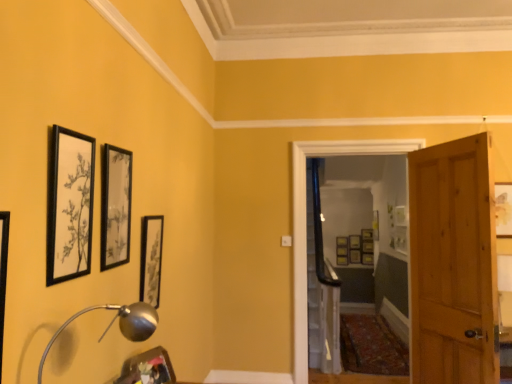
How much space does wooden door at center, which appears as the first door when viewed from the back, occupy vertically?

6.70 feet.

The height and width of the screenshot is (384, 512). What are the coordinates of `wooden door at center, which appears as the first door when viewed from the back` in the screenshot? It's located at (445, 224).

You are a GUI agent. You are given a task and a screenshot of the screen. Output one action in this format:
    pyautogui.click(x=<x>, y=<y>)
    Task: Click on the wooden picture frame at center, the 9th picture frame in the right-to-left sequence
    This screenshot has height=384, width=512.
    Given the screenshot: What is the action you would take?
    pyautogui.click(x=342, y=260)

The height and width of the screenshot is (384, 512). I want to click on wooden picture frame at center, the 10th picture frame in the front-to-back sequence, so click(355, 256).

What is the approximate height of matte black picture frame at center, which is the 3th picture frame in right-to-left order?

matte black picture frame at center, which is the 3th picture frame in right-to-left order, is 10.37 inches in height.

Identify the location of wooden picture frame at center, placed as the eighth picture frame when sorted from right to left. coord(342,251).

In the scene shown: From a real-world perspective, is matte gold picture frame at center, the fourteenth picture frame in the front-to-back sequence, positioned above or below wooden picture frame at center, the 13th picture frame viewed from the front?

Clearly, from a real-world perspective, matte gold picture frame at center, the fourteenth picture frame in the front-to-back sequence, is above wooden picture frame at center, the 13th picture frame viewed from the front.

Would you say matte gold picture frame at center, the fourteenth picture frame in the front-to-back sequence, is to the left or to the right of wooden picture frame at center, the 13th picture frame viewed from the front, in the picture?

matte gold picture frame at center, the fourteenth picture frame in the front-to-back sequence, is to the right of wooden picture frame at center, the 13th picture frame viewed from the front.

Measure the distance from matte gold picture frame at center, which ranks as the 7th picture frame in right-to-left order, to wooden picture frame at center, which is counted as the second picture frame, starting from the back.

5.18 inches.

Based on their sizes in the image, would you say matte gold picture frame at center, which appears as the 8th picture frame when viewed from the left, is bigger or smaller than wooden picture frame at center, which is counted as the second picture frame, starting from the back?

matte gold picture frame at center, which appears as the 8th picture frame when viewed from the left, is smaller than wooden picture frame at center, which is counted as the second picture frame, starting from the back.

Is matte black picture frame at center, which appears as the 7th picture frame when viewed from the front, closer to the viewer compared to wooden door at right, the 2th door viewed from the back?

No, matte black picture frame at center, which appears as the 7th picture frame when viewed from the front, is further to the viewer.

Does matte black picture frame at center, which is the 3th picture frame in right-to-left order, have a greater height compared to wooden door at right, the 2th door viewed from the back?

No.

Between matte black picture frame at center, which is the 3th picture frame in right-to-left order, and wooden door at right, the 2th door viewed from the back, which one appears on the right side from the viewer's perspective?

Positioned to the right is matte black picture frame at center, which is the 3th picture frame in right-to-left order.

From the image's perspective, does matte black picture frame at center, which is the 3th picture frame in right-to-left order, appear lower than wooden door at right, placed as the 1th door when sorted from front to back?

Yes, from the image's perspective, matte black picture frame at center, which is the 3th picture frame in right-to-left order, is beneath wooden door at right, placed as the 1th door when sorted from front to back.

Would you say silver metallic table lamp at lower left is to the left or to the right of black matte picture frame at upper left, which ranks as the 2th picture frame in left-to-right order, in the picture?

silver metallic table lamp at lower left is to the right of black matte picture frame at upper left, which ranks as the 2th picture frame in left-to-right order.

Could you measure the distance between silver metallic table lamp at lower left and black matte picture frame at upper left, the thirteenth picture frame from the right?

A distance of 14.12 inches exists between silver metallic table lamp at lower left and black matte picture frame at upper left, the thirteenth picture frame from the right.

Is silver metallic table lamp at lower left far from black matte picture frame at upper left, which ranks as the 2th picture frame in left-to-right order?

Actually, silver metallic table lamp at lower left and black matte picture frame at upper left, which ranks as the 2th picture frame in left-to-right order, are a little close together.

Based on the photo, from a real-world perspective, which object rests below the other?

silver metallic table lamp at lower left.

Are wooden picture frame at center, the 8th picture frame in the front-to-back sequence, and matte black picture frame at lower left, marked as the fourth picture frame in a front-to-back arrangement, making contact?

No, wooden picture frame at center, the 8th picture frame in the front-to-back sequence, is not in contact with matte black picture frame at lower left, marked as the fourth picture frame in a front-to-back arrangement.

Is wooden picture frame at center, the 2th picture frame viewed from the right, spatially inside matte black picture frame at lower left, placed as the fifth picture frame when sorted from left to right, or outside of it?

wooden picture frame at center, the 2th picture frame viewed from the right, lies outside matte black picture frame at lower left, placed as the fifth picture frame when sorted from left to right.

Is wooden picture frame at center, the 7th picture frame viewed from the back, behind matte black picture frame at lower left, placed as the fifth picture frame when sorted from left to right?

Yes, it is behind matte black picture frame at lower left, placed as the fifth picture frame when sorted from left to right.

Locate an element on the screen. The height and width of the screenshot is (384, 512). the 4th picture frame behind the matte black picture frame at lower left, marked as the fourth picture frame in a front-to-back arrangement, counting from the anchor's position is located at coordinates (367, 246).

Is matte gold picture frame at center, the first picture frame from the back, directly adjacent to matte black picture frame at center, acting as the fourth picture frame starting from the back?

No, matte gold picture frame at center, the first picture frame from the back, is not next to matte black picture frame at center, acting as the fourth picture frame starting from the back.

In terms of width, does matte gold picture frame at center, which ranks as the 7th picture frame in right-to-left order, look wider or thinner when compared to matte black picture frame at center, which is the eleventh picture frame in front-to-back order?

In the image, matte gold picture frame at center, which ranks as the 7th picture frame in right-to-left order, appears to be more narrow than matte black picture frame at center, which is the eleventh picture frame in front-to-back order.

Is matte gold picture frame at center, the fourteenth picture frame in the front-to-back sequence, inside the boundaries of matte black picture frame at center, which is the eleventh picture frame in front-to-back order, or outside?

matte gold picture frame at center, the fourteenth picture frame in the front-to-back sequence, lies outside matte black picture frame at center, which is the eleventh picture frame in front-to-back order.

From the image's perspective, does matte gold picture frame at center, the first picture frame from the back, appear lower than matte black picture frame at center, which is the eleventh picture frame in front-to-back order?

No, from the image's perspective, matte gold picture frame at center, the first picture frame from the back, is not beneath matte black picture frame at center, which is the eleventh picture frame in front-to-back order.

Relative to wooden picture frame at center, the 10th picture frame in the front-to-back sequence, is wooden picture frame at right, which is counted as the ninth picture frame, starting from the left, in front or behind?

wooden picture frame at right, which is counted as the ninth picture frame, starting from the left, is positioned closer to the viewer than wooden picture frame at center, the 10th picture frame in the front-to-back sequence.

Which is behind, point (507, 198) or point (356, 258)?

The point (356, 258) is behind.

Could you tell me if wooden picture frame at right, which is counted as the ninth picture frame, starting from the back, is turned towards wooden picture frame at center, the 10th picture frame positioned from the left?

No, wooden picture frame at right, which is counted as the ninth picture frame, starting from the back, does not turn towards wooden picture frame at center, the 10th picture frame positioned from the left.

Choose the correct answer: Is wooden picture frame at center, placed as the eighth picture frame when sorted from right to left, inside matte gold picture frame at center, the fourteenth picture frame in the front-to-back sequence, or outside it?

wooden picture frame at center, placed as the eighth picture frame when sorted from right to left, is located beyond the bounds of matte gold picture frame at center, the fourteenth picture frame in the front-to-back sequence.

From the image's perspective, starting from the matte gold picture frame at center, the fourteenth picture frame in the front-to-back sequence, which picture frame is the 3rd one below? Please provide its 2D coordinates.

[(342, 251)]

Between wooden picture frame at center, which is counted as the second picture frame, starting from the back, and matte gold picture frame at center, which ranks as the 7th picture frame in right-to-left order, which one has more height?

matte gold picture frame at center, which ranks as the 7th picture frame in right-to-left order.

How much distance is there between wooden picture frame at center, placed as the eighth picture frame when sorted from right to left, and matte gold picture frame at center, the fourteenth picture frame in the front-to-back sequence?

The distance of wooden picture frame at center, placed as the eighth picture frame when sorted from right to left, from matte gold picture frame at center, the fourteenth picture frame in the front-to-back sequence, is 5.18 inches.

Locate an element on the screen. The width and height of the screenshot is (512, 384). picture frame that is the 3rd object located above the wooden picture frame at center, which is counted as the second picture frame, starting from the back (from the image's perspective) is located at coordinates (342, 241).

From a real-world perspective, count 7th picture frames downward from the wooden door at right, the 2th door viewed from the back, and point to it. Please provide its 2D coordinates.

[(367, 258)]

From the picture: From the image, which object appears to be nearer to wooden picture frame at right, which is counted as the ninth picture frame, starting from the back, wooden picture frame at center, the 2th picture frame viewed from the right, or black matte picture frame at center-left, the 5th picture frame in the front-to-back sequence?

black matte picture frame at center-left, the 5th picture frame in the front-to-back sequence, lies closer to wooden picture frame at right, which is counted as the ninth picture frame, starting from the back, than the other object.

Considering their positions, is matte gold picture frame at center, which ranks as the 7th picture frame in right-to-left order, positioned closer to black matte picture frame at center-left, the 5th picture frame in the front-to-back sequence, than black matte picture frame at left, the 14th picture frame when ordered from right to left?

black matte picture frame at left, the 14th picture frame when ordered from right to left, is closer to black matte picture frame at center-left, the 5th picture frame in the front-to-back sequence.

Based on their spatial positions, is black matte picture frame at center-left, which ranks as the 10th picture frame in back-to-front order, or wooden picture frame at center, arranged as the 5th picture frame when viewed from the right, closer to black matte picture frame at upper left, marked as the 2th picture frame in a front-to-back arrangement?

Among the two, black matte picture frame at center-left, which ranks as the 10th picture frame in back-to-front order, is located nearer to black matte picture frame at upper left, marked as the 2th picture frame in a front-to-back arrangement.

Looking at the image, which one is located closer to black matte picture frame at upper left, which ranks as the 13th picture frame in back-to-front order, matte black picture frame at upper center, the third picture frame from the front, or wooden door at right, placed as the 1th door when sorted from front to back?

Among the two, matte black picture frame at upper center, the third picture frame from the front, is located nearer to black matte picture frame at upper left, which ranks as the 13th picture frame in back-to-front order.

Which object lies nearer to the anchor point wooden door at center, which appears as the first door when viewed from the back, matte black picture frame at lower left, marked as the fourth picture frame in a front-to-back arrangement, or matte black picture frame at center, which ranks as the fourth picture frame in right-to-left order?

Among the two, matte black picture frame at lower left, marked as the fourth picture frame in a front-to-back arrangement, is located nearer to wooden door at center, which appears as the first door when viewed from the back.

When comparing their distances from wooden door at right, the 2th door viewed from the back, does wooden picture frame at center, acting as the thirteenth picture frame starting from the left, or matte gold picture frame at center, the first picture frame from the back, seem closer?

Based on the image, wooden picture frame at center, acting as the thirteenth picture frame starting from the left, appears to be nearer to wooden door at right, the 2th door viewed from the back.

Looking at the image, which one is located further to matte gold picture frame at center, which appears as the 8th picture frame when viewed from the left, wooden picture frame at center, the 6th picture frame viewed from the left, or black matte picture frame at left, acting as the 1th picture frame starting from the left?

black matte picture frame at left, acting as the 1th picture frame starting from the left.

From the image, which object appears to be farther from black matte picture frame at upper left, which ranks as the 2th picture frame in left-to-right order, wooden picture frame at center, placed as the eighth picture frame when sorted from right to left, or matte black picture frame at upper center, the 3th picture frame positioned from the left?

wooden picture frame at center, placed as the eighth picture frame when sorted from right to left, lies further to black matte picture frame at upper left, which ranks as the 2th picture frame in left-to-right order, than the other object.

Locate an element on the screen. The width and height of the screenshot is (512, 384). table lamp between black matte picture frame at upper left, the thirteenth picture frame from the right, and matte black picture frame at lower left, the 11th picture frame positioned from the back, from top to bottom is located at coordinates (119, 324).

At what (x,y) coordinates should I click in order to perform the action: click on table lamp between black matte picture frame at left, the fourteenth picture frame from the back, and wooden picture frame at center, which is counted as the twelfth picture frame, starting from the front, from front to back. Please return your answer as a coordinate pair (x, y). This screenshot has height=384, width=512. Looking at the image, I should click on (119, 324).

In order to click on picture frame between black matte picture frame at center-left, which appears as the fourth picture frame when viewed from the left, and matte black picture frame at center, which appears as the 7th picture frame when viewed from the front, in the front-back direction in this screenshot , I will do `click(503, 209)`.

Locate an element on the screen. This screenshot has width=512, height=384. picture frame between wooden door at center, which appears as the first door when viewed from the back, and wooden picture frame at center, the 8th picture frame in the front-to-back sequence, in the front-back direction is located at coordinates (367, 258).